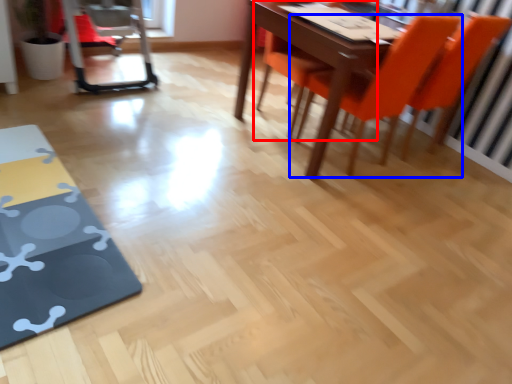
Question: Which point is further to the camera, chair (highlighted by a red box) or chair (highlighted by a blue box)?

Choices:
 (A) chair
 (B) chair

Answer: (A)